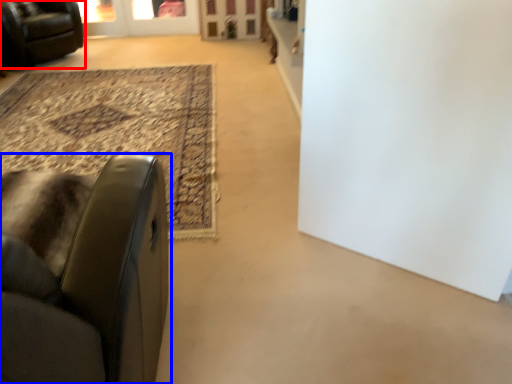
Question: Which point is further to the camera, chair (highlighted by a red box) or chair (highlighted by a blue box)?

Choices:
 (A) chair
 (B) chair

Answer: (A)